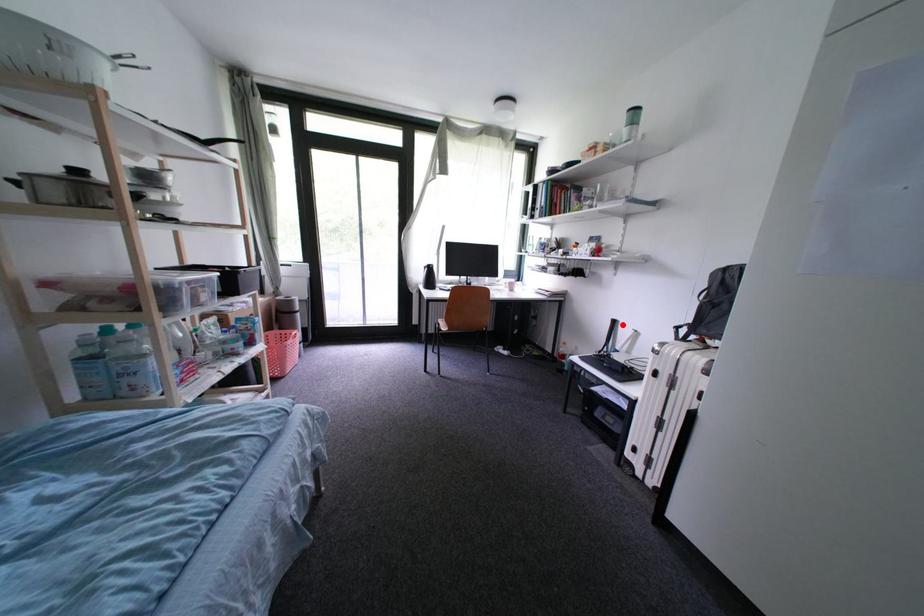
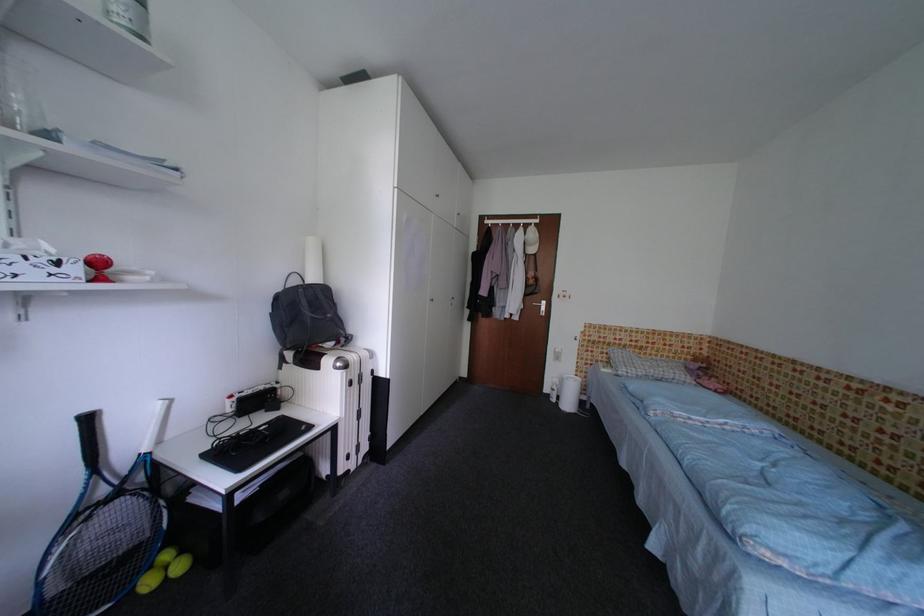
Locate, in the second image, the point that corresponds to the highlighted location in the first image.

(98, 422)